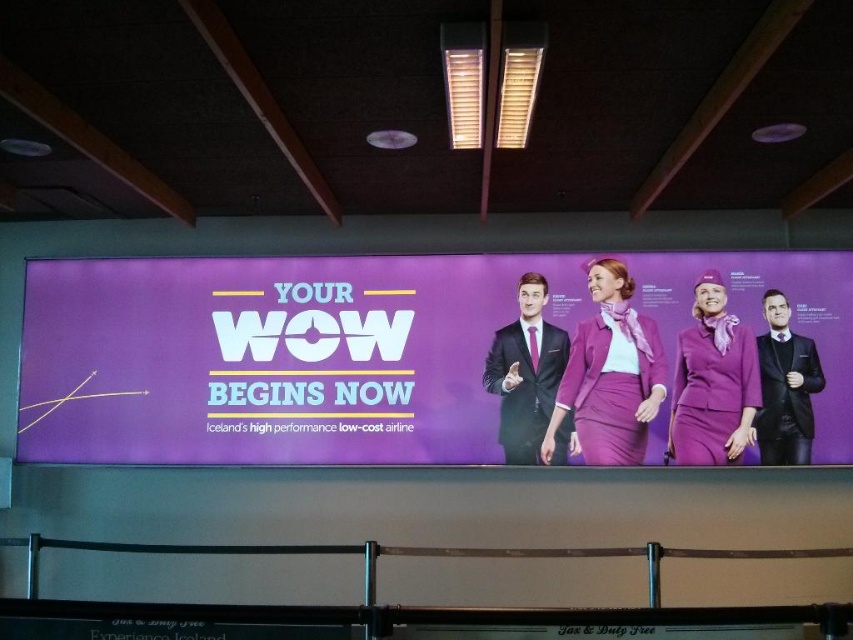
Question: Can you confirm if matte black suit at center is positioned below matte black suit at right?

Choices:
 (A) yes
 (B) no

Answer: (B)

Question: Which point is farther from the camera taking this photo?

Choices:
 (A) [538, 420]
 (B) [409, 292]

Answer: (B)

Question: Estimate the real-world distances between objects in this image. Which object is farther from the matte black suit at center?

Choices:
 (A) matte black suit at right
 (B) purple fabric billboard at center

Answer: (A)

Question: Among these objects, which one is nearest to the camera?

Choices:
 (A) matte black suit at right
 (B) purple fabric billboard at center

Answer: (A)

Question: Can you confirm if purple fabric billboard at center is thinner than matte black suit at right?

Choices:
 (A) yes
 (B) no

Answer: (B)

Question: Does purple fabric billboard at center appear under matte black suit at center?

Choices:
 (A) no
 (B) yes

Answer: (A)